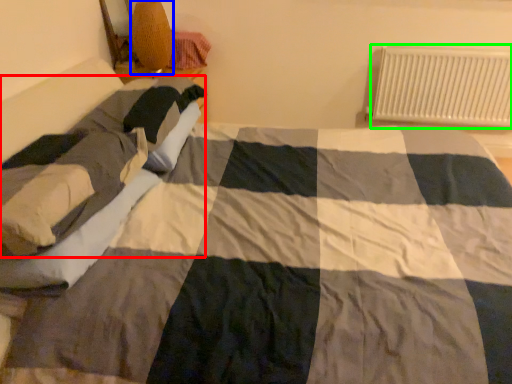
Question: Which object is positioned closest to person (highlighted by a red box)? Select from lamp (highlighted by a blue box) and radiator (highlighted by a green box).

Choices:
 (A) lamp
 (B) radiator

Answer: (A)